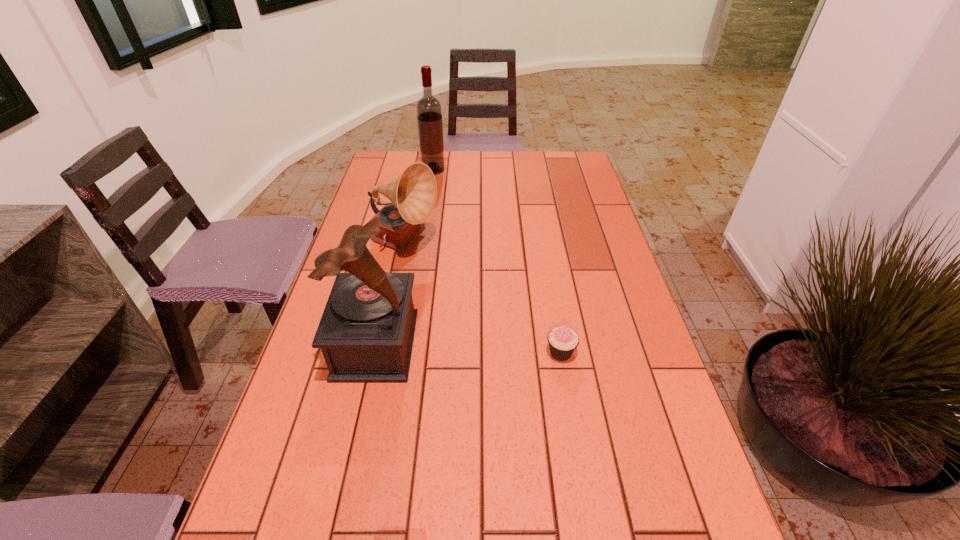
Where is `the farthest object`? This screenshot has height=540, width=960. the farthest object is located at coordinates (429, 112).

Identify the location of the nearer phonograph record. (366, 332).

Locate an element on the screen. The image size is (960, 540). the shorter phonograph record is located at coordinates (412, 194).

You are a GUI agent. You are given a task and a screenshot of the screen. Output one action in this format:
    pyautogui.click(x=<x>, y=<y>)
    Task: Click on the farther phonograph record
    This screenshot has width=960, height=540.
    Given the screenshot: What is the action you would take?
    pyautogui.click(x=412, y=194)

Image resolution: width=960 pixels, height=540 pixels. I want to click on the shortest object, so click(x=563, y=341).

At what (x,y) coordinates should I click in order to perform the action: click on cupcake. Please return your answer as a coordinate pair (x, y). Looking at the image, I should click on pos(563,341).

This screenshot has height=540, width=960. I want to click on free point located 0.050m on the back of the wine bottle, so click(x=436, y=159).

Locate an element on the screen. free region located at the horn opening of the nearer phonograph record is located at coordinates pos(465,345).

Locate an element on the screen. This screenshot has width=960, height=540. vacant space located on the horn of the second farthest object is located at coordinates (540, 245).

This screenshot has width=960, height=540. In order to click on free location located on the front of the rightmost object in this screenshot , I will do `click(566, 383)`.